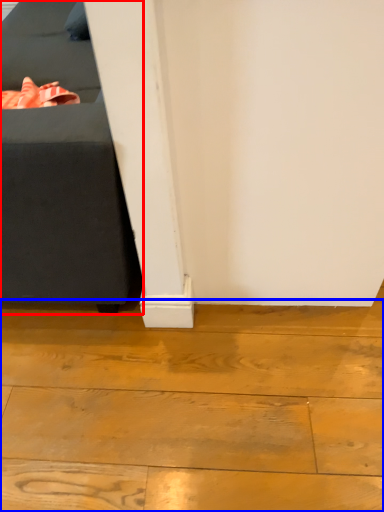
Question: Which of the following is the closest to the observer, furniture (highlighted by a red box) or wood (highlighted by a blue box)?

Choices:
 (A) furniture
 (B) wood

Answer: (A)